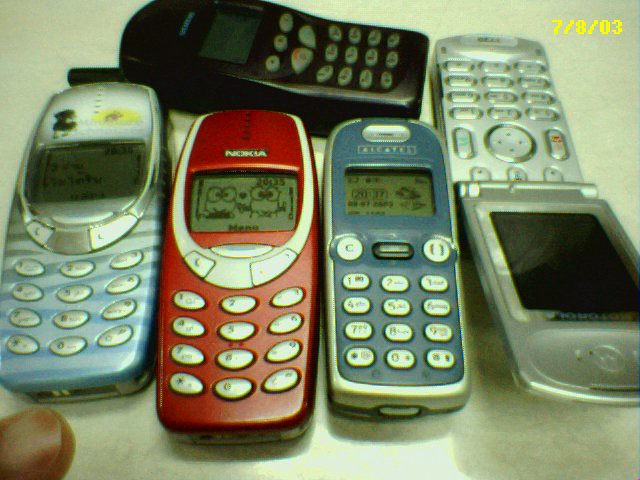
Locate an element on the screen. This screenshot has width=640, height=480. screen is located at coordinates click(93, 176), click(253, 200), click(381, 190), click(545, 258), click(230, 46).